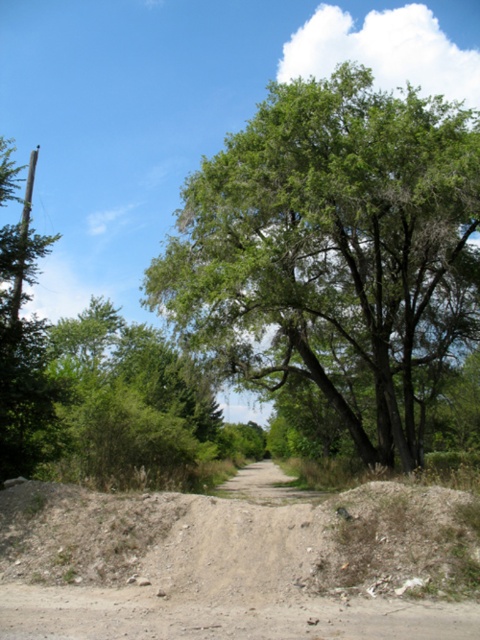
Question: Can you confirm if green leafy tree at center is positioned to the left of green leafy tree at left?

Choices:
 (A) yes
 (B) no

Answer: (B)

Question: Which point is farther to the camera?

Choices:
 (A) green leafy tree at center
 (B) green leafy tree at left

Answer: (A)

Question: Can you confirm if brown gravel dirt track at center is bigger than green leafy tree at left?

Choices:
 (A) no
 (B) yes

Answer: (A)

Question: Can you confirm if green leafy tree at center is wider than green leafy tree at left?

Choices:
 (A) yes
 (B) no

Answer: (B)

Question: Which point appears closest to the camera in this image?

Choices:
 (A) (216, 234)
 (B) (181, 564)

Answer: (B)

Question: Estimate the real-world distances between objects in this image. Which object is closer to the green leafy tree at left?

Choices:
 (A) green leafy tree at center
 (B) brown gravel dirt track at center

Answer: (B)